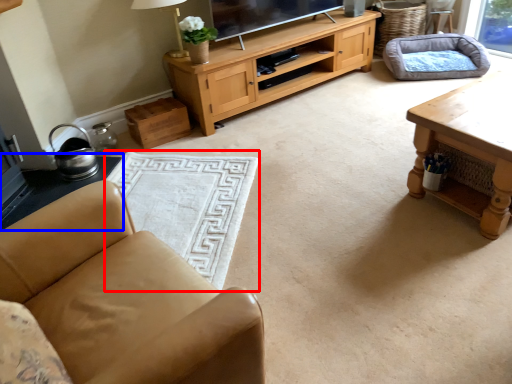
Question: Which of the following is the farthest to the observer, flat (highlighted by a red box) or side table (highlighted by a blue box)?

Choices:
 (A) flat
 (B) side table

Answer: (B)